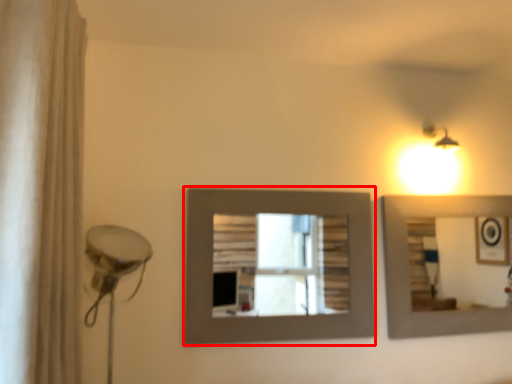
Question: From the image's perspective, what is the correct spatial relationship of picture frame (annotated by the red box) in relation to shower curtain?

Choices:
 (A) above
 (B) below

Answer: (B)